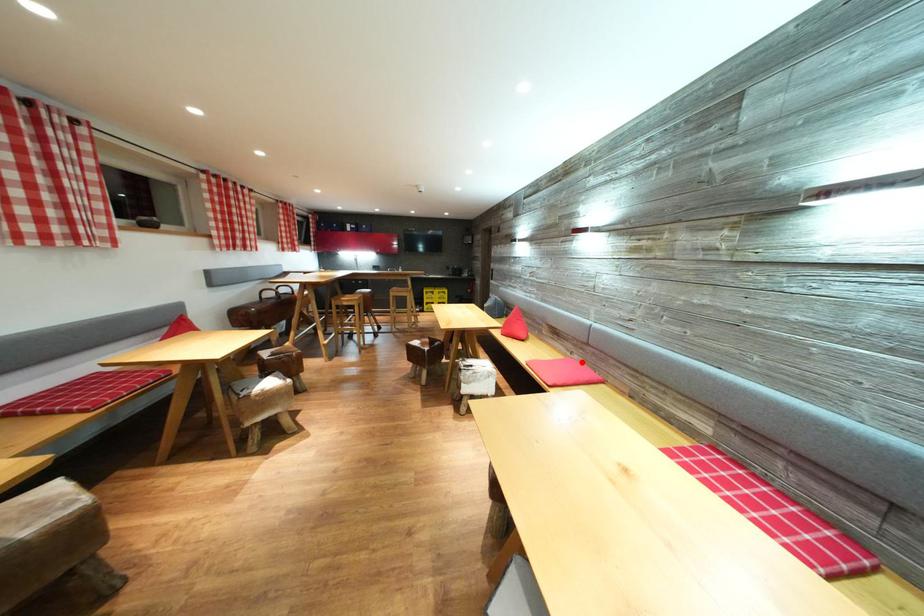
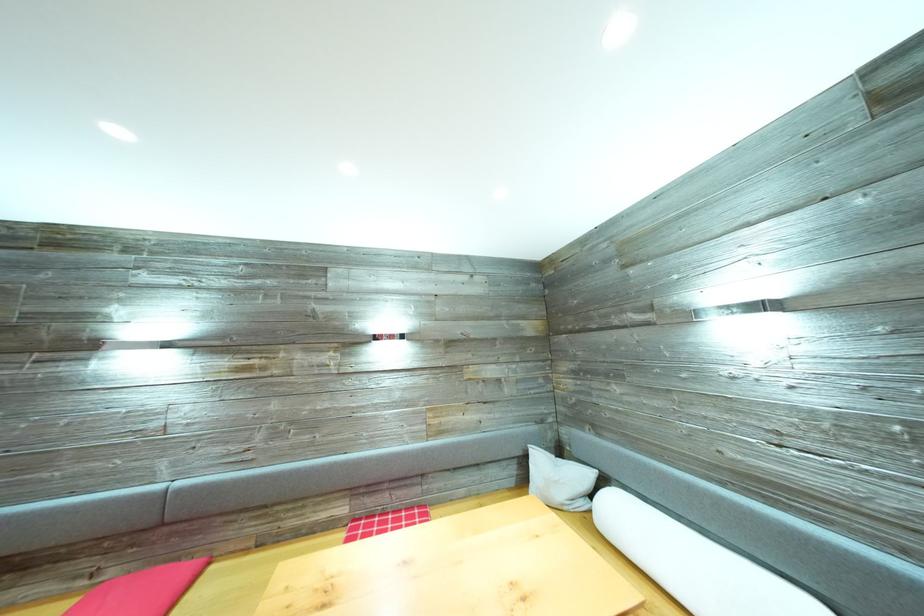
Locate, in the second image, the point that corresponds to the highlighted location in the first image.

(117, 578)